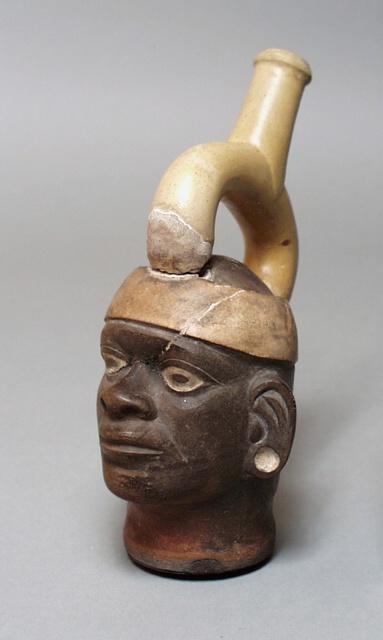
Question: Which point is farther to the camera?

Choices:
 (A) brown matte/earthenware face at center
 (B) matte brown ceramic head at center

Answer: (A)

Question: Which of the following is the farthest from the observer?

Choices:
 (A) (158, 340)
 (B) (168, 548)

Answer: (B)

Question: Can you confirm if matte brown ceramic head at center is positioned to the left of brown matte/earthenware face at center?

Choices:
 (A) no
 (B) yes

Answer: (A)

Question: Does matte brown ceramic head at center come behind brown matte/earthenware face at center?

Choices:
 (A) yes
 (B) no

Answer: (B)

Question: Where is matte brown ceramic head at center located in relation to brown matte/earthenware face at center in the image?

Choices:
 (A) below
 (B) above

Answer: (B)